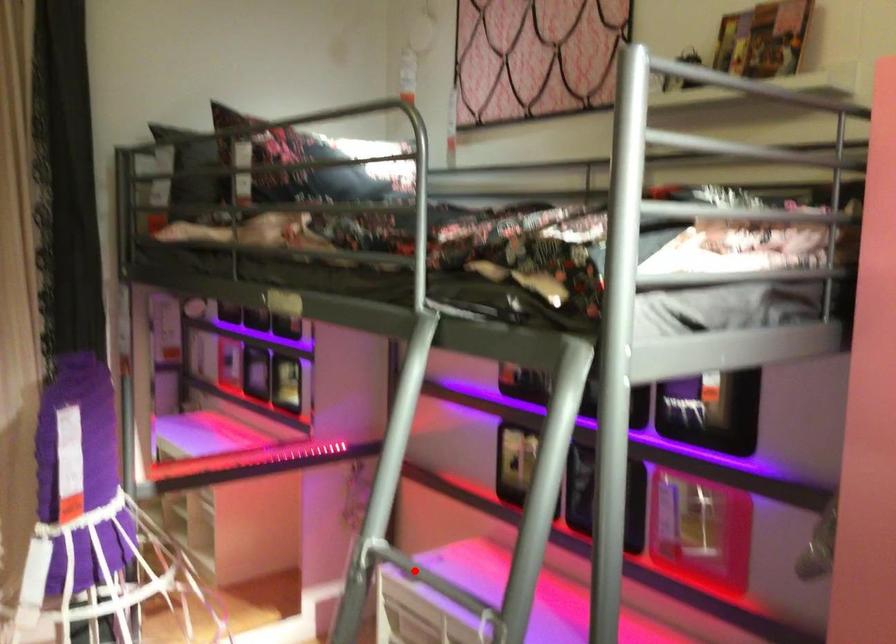
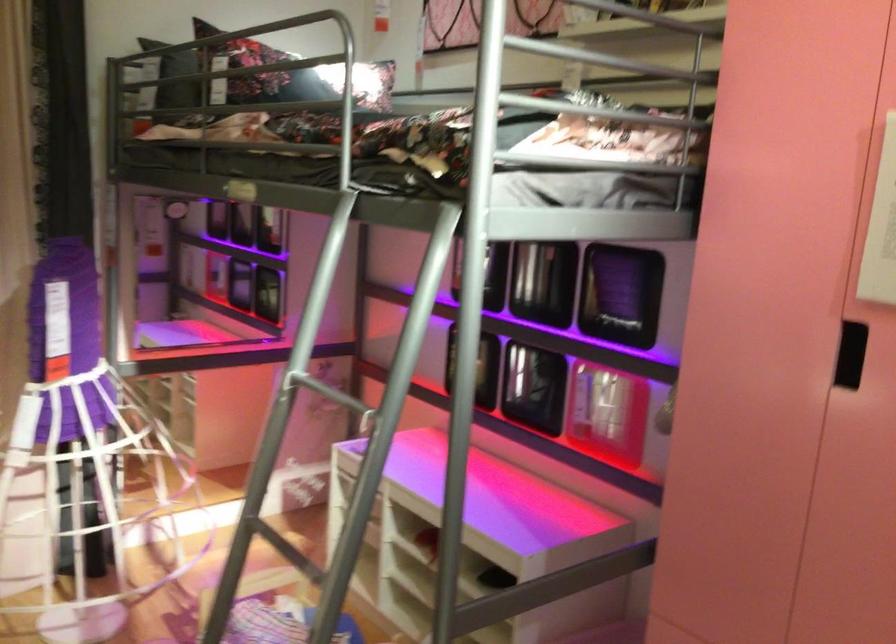
Question: I am providing you with two images of the same scene from different viewpoints. In image1, a red point is highlighted. Considering the same 3D point in image2, which of the following is correct?

Choices:
 (A) It is closer
 (B) It is farther

Answer: (B)